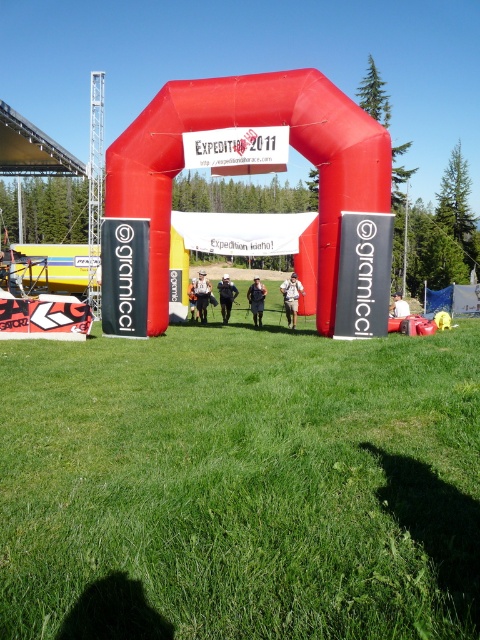
Which is in front, point (244, 634) or point (396, 296)?

Point (244, 634) is in front.

Identify the location of green grassy field at center. point(240,486).

Between point (354, 387) and point (400, 316), which one is positioned in front?

Positioned in front is point (354, 387).

The image size is (480, 640). In order to click on green grassy field at center in this screenshot , I will do `click(240, 486)`.

Is dark blue jeans at center smaller than white fabric person at center?

Correct, dark blue jeans at center occupies less space than white fabric person at center.

Can you confirm if dark blue jeans at center is wider than white fabric person at center?

Incorrect, dark blue jeans at center's width does not surpass white fabric person at center's.

What do you see at coordinates (256, 300) in the screenshot? The image size is (480, 640). I see `dark blue jeans at center` at bounding box center [256, 300].

Find the location of `dark blue jeans at center`. dark blue jeans at center is located at coordinates (256, 300).

Is camouflage jacket at center behind white fabric person at center?

Yes.

Between point (287, 298) and point (398, 310), which one is positioned behind?

The point (287, 298) is behind.

Is point (295, 292) farther from camera compared to point (389, 305)?

Yes, point (295, 292) is farther from viewer.

Image resolution: width=480 pixels, height=640 pixels. In order to click on camouflage jacket at center in this screenshot , I will do `click(291, 298)`.